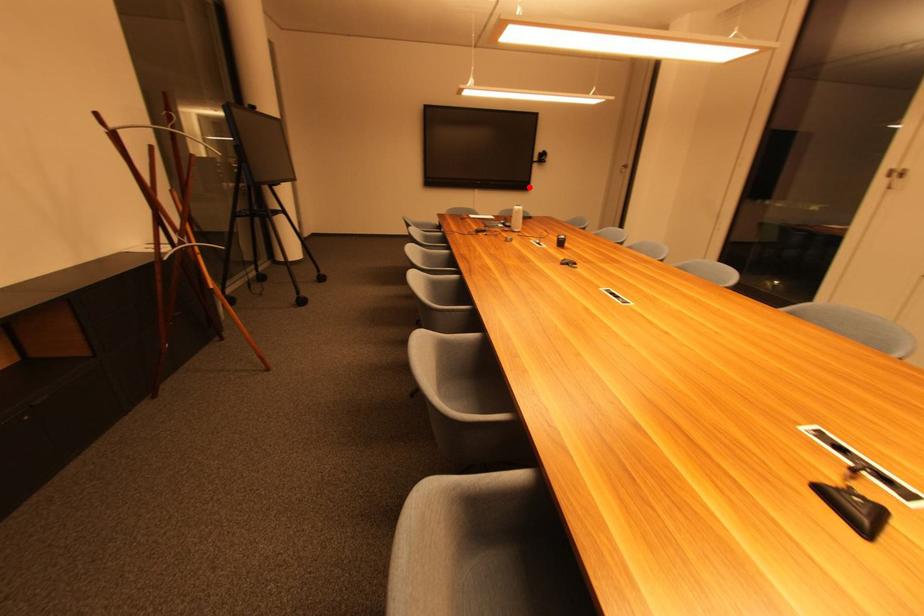
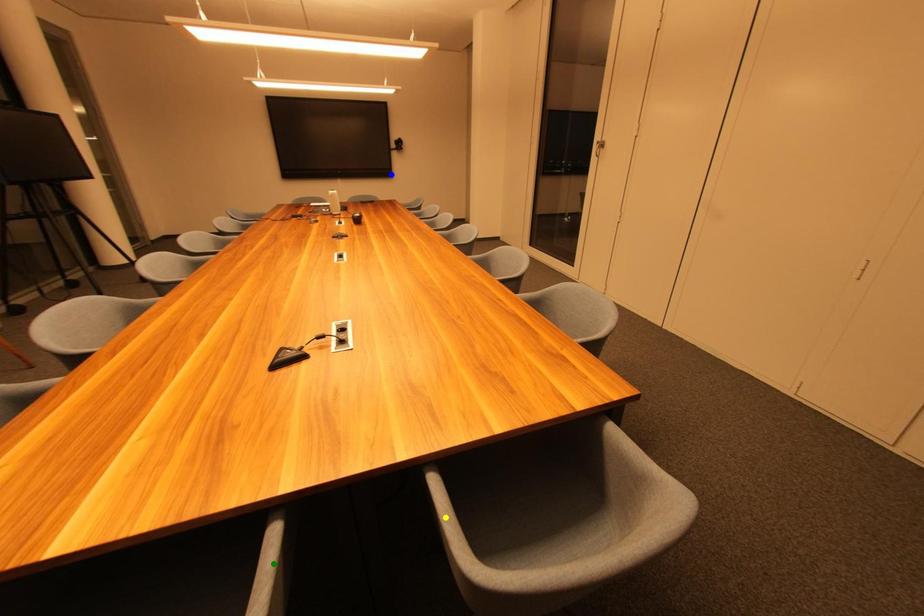
Question: I am providing you with two images of the same scene from different viewpoints. A red point is marked on the first image. You are given multiple points on the second image. Which point in image 2 represents the same 3d spot as the red point in image 1?

Choices:
 (A) yellow point
 (B) green point
 (C) blue point

Answer: (C)